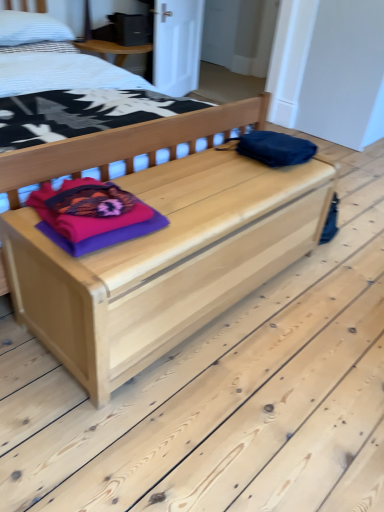
Question: From a real-world perspective, does white textured pillow at upper left stand above natural wood bed at center?

Choices:
 (A) yes
 (B) no

Answer: (A)

Question: Is white textured pillow at upper left facing towards natural wood bed at center?

Choices:
 (A) yes
 (B) no

Answer: (A)

Question: Is white textured pillow at upper left with natural wood bed at center?

Choices:
 (A) yes
 (B) no

Answer: (B)

Question: Can you confirm if white textured pillow at upper left is shorter than natural wood bed at center?

Choices:
 (A) yes
 (B) no

Answer: (A)

Question: Is white textured pillow at upper left facing away from natural wood bed at center?

Choices:
 (A) yes
 (B) no

Answer: (A)

Question: In the image, is natural wood chest at center positioned in front of or behind purple fabric at center?

Choices:
 (A) behind
 (B) front

Answer: (B)

Question: In the image, is natural wood chest at center on the left side or the right side of purple fabric at center?

Choices:
 (A) right
 (B) left

Answer: (A)

Question: Is point (114, 372) closer or farther from the camera than point (74, 224)?

Choices:
 (A) closer
 (B) farther

Answer: (B)

Question: In terms of width, does natural wood chest at center look wider or thinner when compared to purple fabric at center?

Choices:
 (A) wide
 (B) thin

Answer: (A)

Question: From the image's perspective, is natural wood bed at center located above or below purple fabric at center?

Choices:
 (A) above
 (B) below

Answer: (A)

Question: Would you say natural wood bed at center is inside or outside purple fabric at center?

Choices:
 (A) inside
 (B) outside

Answer: (B)

Question: In the image, is natural wood bed at center positioned in front of or behind purple fabric at center?

Choices:
 (A) front
 (B) behind

Answer: (A)

Question: Considering the positions of natural wood bed at center and purple fabric at center in the image, is natural wood bed at center wider or thinner than purple fabric at center?

Choices:
 (A) thin
 (B) wide

Answer: (B)

Question: Visually, is purple fabric at center positioned to the left or to the right of natural wood bed at center?

Choices:
 (A) right
 (B) left

Answer: (A)

Question: Choose the correct answer: Is purple fabric at center inside natural wood bed at center or outside it?

Choices:
 (A) inside
 (B) outside

Answer: (B)